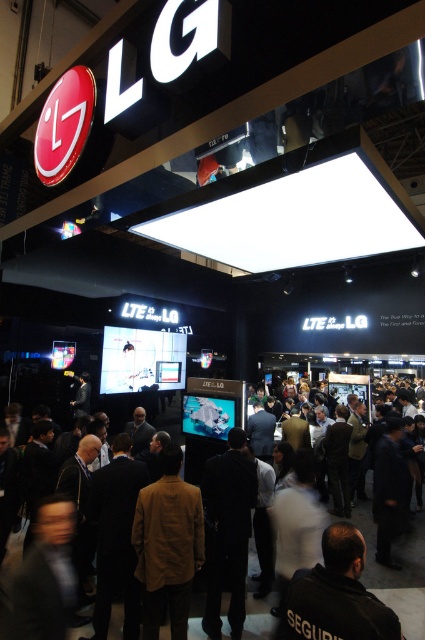
Question: In this image, where is brown leather jacket at center located relative to dark gray clothing at center?

Choices:
 (A) above
 (B) below

Answer: (A)

Question: Can you confirm if brown leather jacket at center is thinner than dark gray clothing at center?

Choices:
 (A) no
 (B) yes

Answer: (B)

Question: Which of the following is the closest to the observer?

Choices:
 (A) (422, 612)
 (B) (396, 634)
 (C) (193, 557)

Answer: (B)

Question: Which object is farther from the camera taking this photo?

Choices:
 (A) black leather jacket at lower center
 (B) brown leather jacket at center

Answer: (B)

Question: Estimate the real-world distances between objects in this image. Which object is farther from the brown leather jacket at center?

Choices:
 (A) dark gray clothing at center
 (B) black leather jacket at lower center

Answer: (A)

Question: Where is brown leather jacket at center located in relation to dark gray clothing at center in the image?

Choices:
 (A) above
 (B) below

Answer: (A)